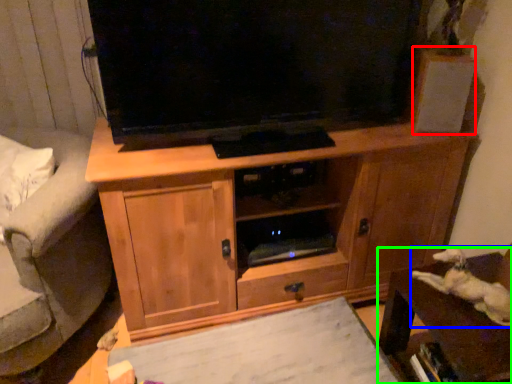
Question: Estimate the real-world distances between objects in this image. Which object is closer to speaker (highlighted by a red box), animal (highlighted by a blue box) or furniture (highlighted by a green box)?

Choices:
 (A) animal
 (B) furniture

Answer: (A)